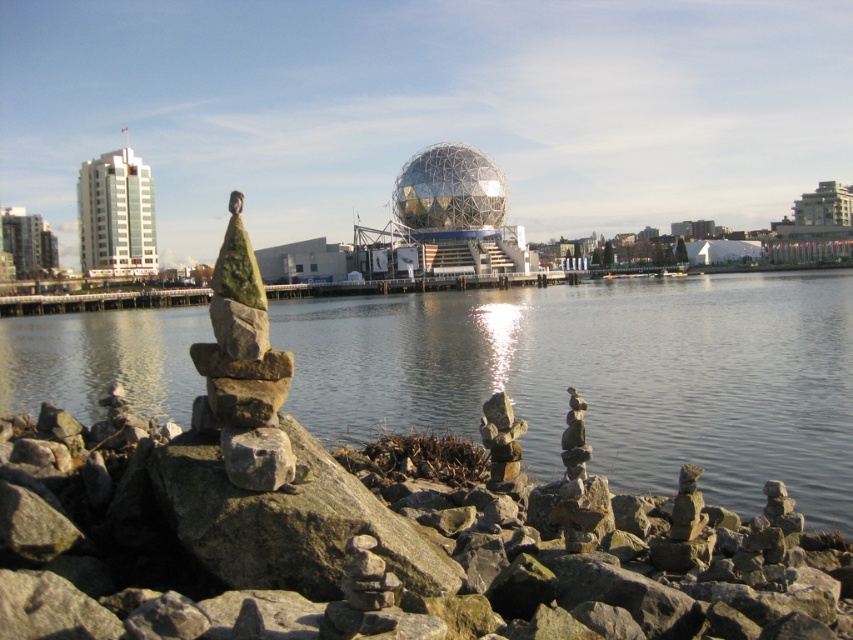
Does point (660, 627) lie in front of point (788, 339)?

That is True.

The image size is (853, 640). In order to click on smooth gray rock at center in this screenshot , I will do `click(370, 545)`.

Can you confirm if smooth gray rock at center is thinner than shiny metallic sphere at center?

Yes, smooth gray rock at center is thinner than shiny metallic sphere at center.

Between smooth gray rock at center and shiny metallic sphere at center, which one is positioned higher?

shiny metallic sphere at center is higher up.

Is point (699, 474) less distant than point (490, 189)?

Yes, point (699, 474) is closer to viewer.

Where is `smooth gray rock at center`? The image size is (853, 640). smooth gray rock at center is located at coordinates (370, 545).

Is clear water at center to the right of shiny metallic sphere at center from the viewer's perspective?

Indeed, clear water at center is positioned on the right side of shiny metallic sphere at center.

Who is higher up, clear water at center or shiny metallic sphere at center?

shiny metallic sphere at center

Identify the location of clear water at center. Image resolution: width=853 pixels, height=640 pixels. (605, 376).